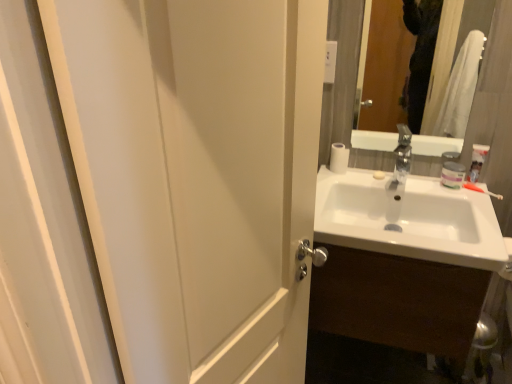
Find the location of a particular element. The height and width of the screenshot is (384, 512). vacant space situated on the left part of white glossy toothpaste at upper right is located at coordinates (428, 182).